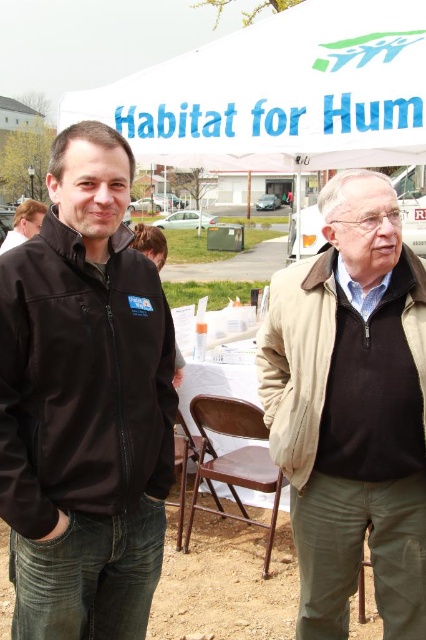
Is black softshell jacket at left above beige fabric jacket at right?

Indeed, black softshell jacket at left is positioned over beige fabric jacket at right.

The height and width of the screenshot is (640, 426). I want to click on black softshell jacket at left, so click(x=81, y=380).

You are a GUI agent. You are given a task and a screenshot of the screen. Output one action in this format:
    pyautogui.click(x=<x>, y=<y>)
    Task: Click on the black softshell jacket at left
    This screenshot has height=640, width=426.
    Given the screenshot: What is the action you would take?
    pyautogui.click(x=81, y=380)

Which is below, dirt field at lower center or matte black jacket at center?

dirt field at lower center

The height and width of the screenshot is (640, 426). I want to click on dirt field at lower center, so click(x=226, y=582).

You are a GUI agent. You are given a task and a screenshot of the screen. Output one action in this format:
    pyautogui.click(x=<x>, y=<y>)
    Task: Click on the dirt field at lower center
    Image resolution: width=426 pixels, height=640 pixels.
    Given the screenshot: What is the action you would take?
    pyautogui.click(x=226, y=582)

Who is more forward, (316, 88) or (13, 241)?

Point (316, 88) is in front.

Who is taller, white fabric canopy at upper center or matte black jacket at center?

With more height is matte black jacket at center.

Between point (322, 131) and point (31, 216), which one is positioned behind?

The point (31, 216) is more distant.

The height and width of the screenshot is (640, 426). Find the location of `white fabric canopy at upper center`. white fabric canopy at upper center is located at coordinates (281, 93).